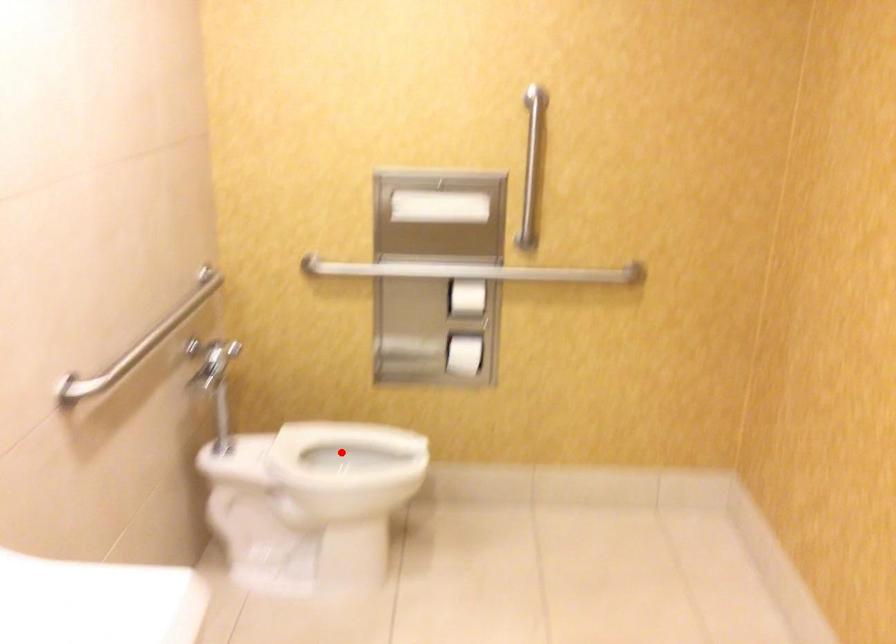
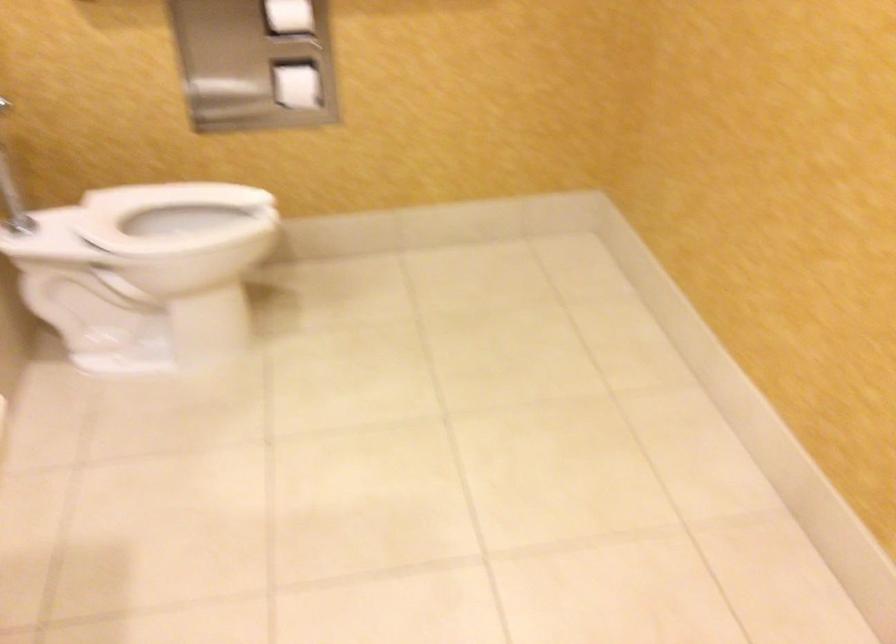
Where in the second image is the point corresponding to the highlighted location from the first image?

(174, 216)